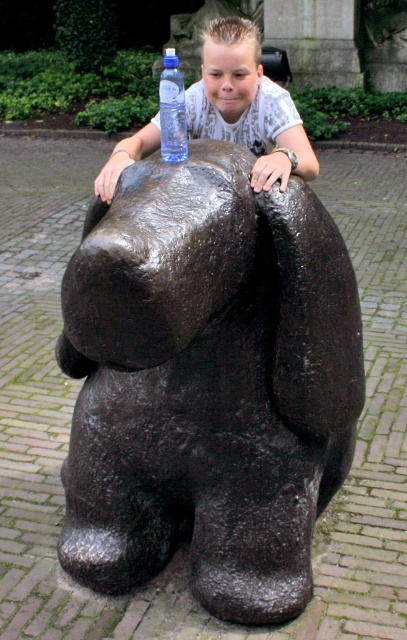
Which of these two, black polished stone bear at center or smooth blue water bottle at upper center, stands shorter?

smooth blue water bottle at upper center

Identify the location of black polished stone bear at center. (207, 384).

You are a GUI agent. You are given a task and a screenshot of the screen. Output one action in this format:
    pyautogui.click(x=<x>, y=<y>)
    Task: Click on the black polished stone bear at center
    
    Given the screenshot: What is the action you would take?
    pyautogui.click(x=207, y=384)

What are the coordinates of `black polished stone bear at center` in the screenshot? It's located at (207, 384).

Is smooth blue water bottle at upper center taller than transparent plastic bottle at upper center?

Yes.

Is point (205, 132) farther from camera compared to point (166, 140)?

Yes.

Is point (231, 54) positioned behind point (177, 61)?

Yes, it is.

This screenshot has height=640, width=407. I want to click on smooth blue water bottle at upper center, so click(x=247, y=106).

Between black polished stone bear at center and transparent plastic bottle at upper center, which one is positioned lower?

black polished stone bear at center is below.

Between point (297, 552) and point (166, 134), which one is positioned in front?

Point (166, 134) is more forward.

Locate an element on the screen. This screenshot has height=640, width=407. black polished stone bear at center is located at coordinates (207, 384).